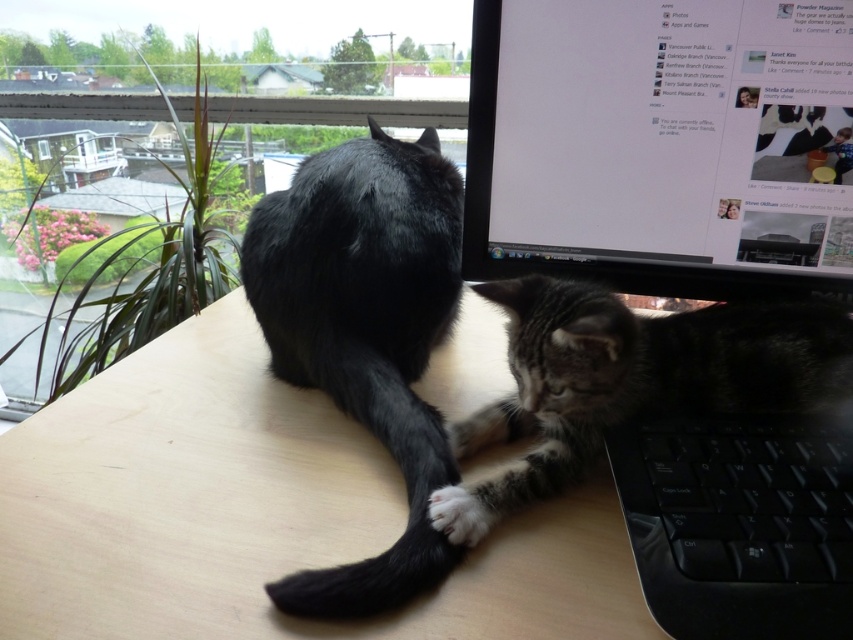
Question: Based on their relative distances, which object is nearer to the tabby fur cat at lower right?

Choices:
 (A) black fur cat at center
 (B) matte black monitor at upper right
 (C) black plastic monitor at center

Answer: (C)

Question: Is matte black monitor at upper right further to camera compared to tabby fur cat at lower right?

Choices:
 (A) yes
 (B) no

Answer: (A)

Question: Based on their relative distances, which object is farther from the wooden table at center?

Choices:
 (A) black fur cat at center
 (B) black plastic monitor at center
 (C) tabby fur cat at lower right

Answer: (B)

Question: Does wooden table at center lie in front of matte black monitor at upper right?

Choices:
 (A) yes
 (B) no

Answer: (A)

Question: Can you confirm if black plastic monitor at center is positioned above matte black monitor at upper right?

Choices:
 (A) no
 (B) yes

Answer: (A)

Question: Based on their relative distances, which object is farther from the matte black monitor at upper right?

Choices:
 (A) wooden table at center
 (B) tabby fur cat at lower right

Answer: (A)